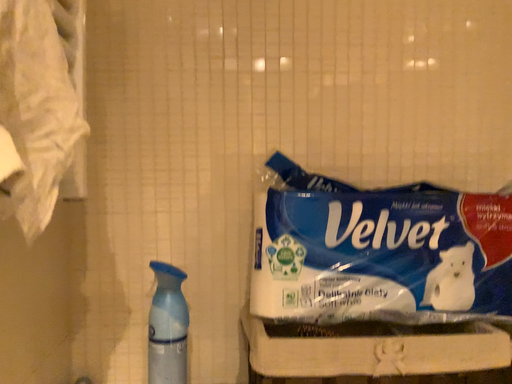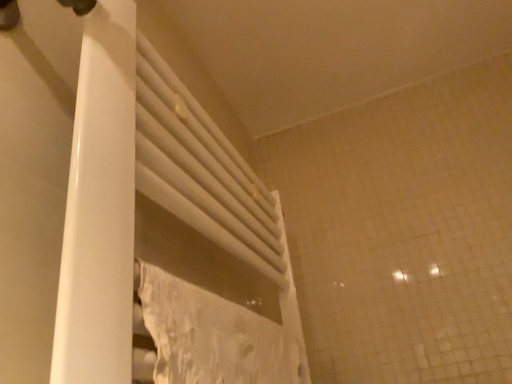
Question: Which way did the camera rotate in the video?

Choices:
 (A) rotated right
 (B) rotated left

Answer: (B)